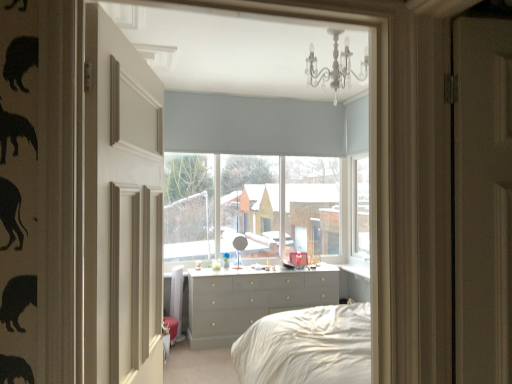
Question: Is light grey fabric blind at upper center positioned in front of matte gray roller blind at center?

Choices:
 (A) no
 (B) yes

Answer: (B)

Question: From a real-world perspective, is light grey fabric blind at upper center under matte gray roller blind at center?

Choices:
 (A) no
 (B) yes

Answer: (A)

Question: From the image's perspective, is light grey fabric blind at upper center on matte gray roller blind at center?

Choices:
 (A) no
 (B) yes

Answer: (B)

Question: Is light grey fabric blind at upper center with matte gray roller blind at center?

Choices:
 (A) yes
 (B) no

Answer: (B)

Question: Is light grey fabric blind at upper center positioned with its back to matte gray roller blind at center?

Choices:
 (A) yes
 (B) no

Answer: (A)

Question: Does light grey fabric blind at upper center have a lesser height compared to matte gray roller blind at center?

Choices:
 (A) no
 (B) yes

Answer: (B)

Question: Is white crystal chandelier at upper center not near matte gray roller blind at center?

Choices:
 (A) no
 (B) yes

Answer: (B)

Question: Is white crystal chandelier at upper center closer to camera compared to matte gray roller blind at center?

Choices:
 (A) yes
 (B) no

Answer: (A)

Question: From a real-world perspective, is white crystal chandelier at upper center below matte gray roller blind at center?

Choices:
 (A) no
 (B) yes

Answer: (A)

Question: Does white crystal chandelier at upper center have a greater height compared to matte gray roller blind at center?

Choices:
 (A) no
 (B) yes

Answer: (A)

Question: From the image's perspective, would you say white crystal chandelier at upper center is positioned over matte gray roller blind at center?

Choices:
 (A) yes
 (B) no

Answer: (A)

Question: Can you confirm if white crystal chandelier at upper center is positioned to the right of matte gray roller blind at center?

Choices:
 (A) no
 (B) yes

Answer: (B)

Question: Is matte gray dresser at center a part of matte gray roller blind at center?

Choices:
 (A) yes
 (B) no

Answer: (B)